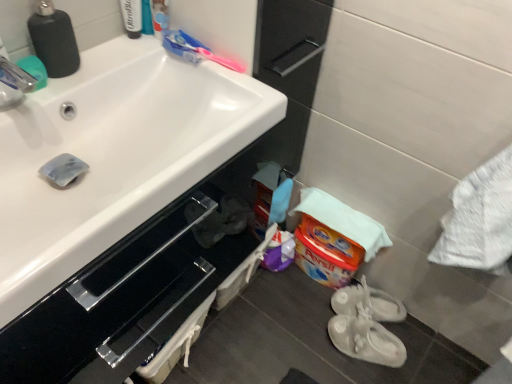
The height and width of the screenshot is (384, 512). Find the location of `vacant space to the right of black matte soap dispenser at upper left`. vacant space to the right of black matte soap dispenser at upper left is located at coordinates (129, 67).